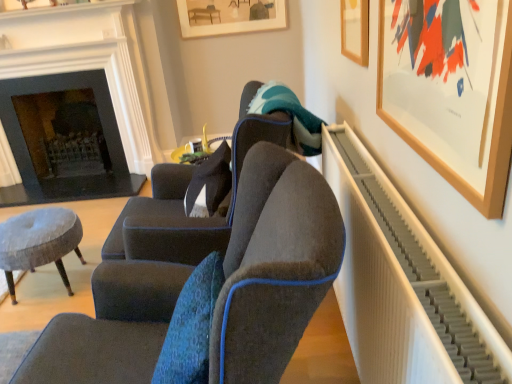
Question: From the image's perspective, is wooden picture frame at upper right, placed as the 2th picture frame when sorted from bottom to top, positioned above or below wooden framed artwork at upper center, which is the first picture frame from left to right?

Choices:
 (A) below
 (B) above

Answer: (A)

Question: Considering the positions of wooden picture frame at upper right, placed as the 2th picture frame when sorted from bottom to top, and wooden framed artwork at upper center, which is the first picture frame from left to right, in the image, is wooden picture frame at upper right, placed as the 2th picture frame when sorted from bottom to top, bigger or smaller than wooden framed artwork at upper center, which is the first picture frame from left to right,?

Choices:
 (A) small
 (B) big

Answer: (A)

Question: Considering the real-world distances, which object is closest to the velvet dark gray chair at center, positioned as the 1th chair in front-to-back order?

Choices:
 (A) white ribbed radiator at right
 (B) velvet grey stool at lower left
 (C) wooden picture frame at upper right, which appears as the second picture frame when viewed from the front
 (D) dark gray stone fireplace at left
 (E) velvet dark gray armchair at center, which is the 2th chair in front-to-back order

Answer: (A)

Question: Which object is positioned farthest from the velvet dark gray chair at center, positioned as the 1th chair in front-to-back order?

Choices:
 (A) velvet grey stool at lower left
 (B) white ribbed radiator at right
 (C) dark gray stone fireplace at left
 (D) wooden framed artwork at upper center, which is the third picture frame in right-to-left order
 (E) wooden picture frame at upper right, the 2th picture frame when ordered from back to front

Answer: (D)